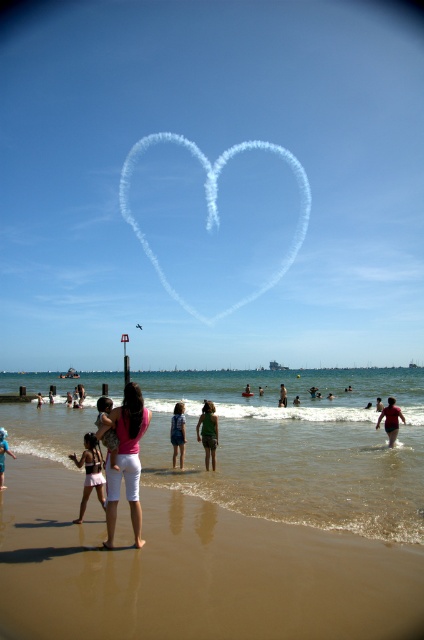
You are a photographer trying to capture a shot of both the denim shorts at center and the green fabric shorts at center. Which pair of shorts will appear narrower in the photo?

→ The denim shorts at center will appear narrower in the photo because it is thinner than the green fabric shorts at center.

You are a photographer trying to capture a photo of the denim shorts at center and the green fabric shorts at center. Which one is located to the left of the other?

The denim shorts at center is positioned on the left side of green fabric shorts at center.